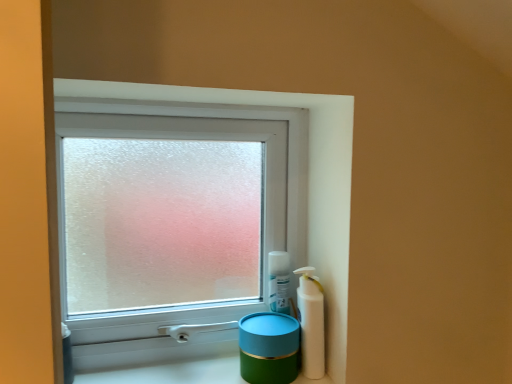
Question: Do you think green matte container at lower center is within teal glossy jar at lower right, or outside of it?

Choices:
 (A) inside
 (B) outside

Answer: (B)

Question: Is green matte container at lower center to the left or to the right of teal glossy jar at lower right in the image?

Choices:
 (A) right
 (B) left

Answer: (B)

Question: Based on their relative distances, which object is farther from the white plastic bottle at right?

Choices:
 (A) teal glossy jar at lower right
 (B) frosted glass window at center
 (C) green matte container at lower center

Answer: (B)

Question: Estimate the real-world distances between objects in this image. Which object is farther from the green matte container at lower center?

Choices:
 (A) white plastic bottle at right
 (B) frosted glass window at center
 (C) teal glossy jar at lower right

Answer: (B)